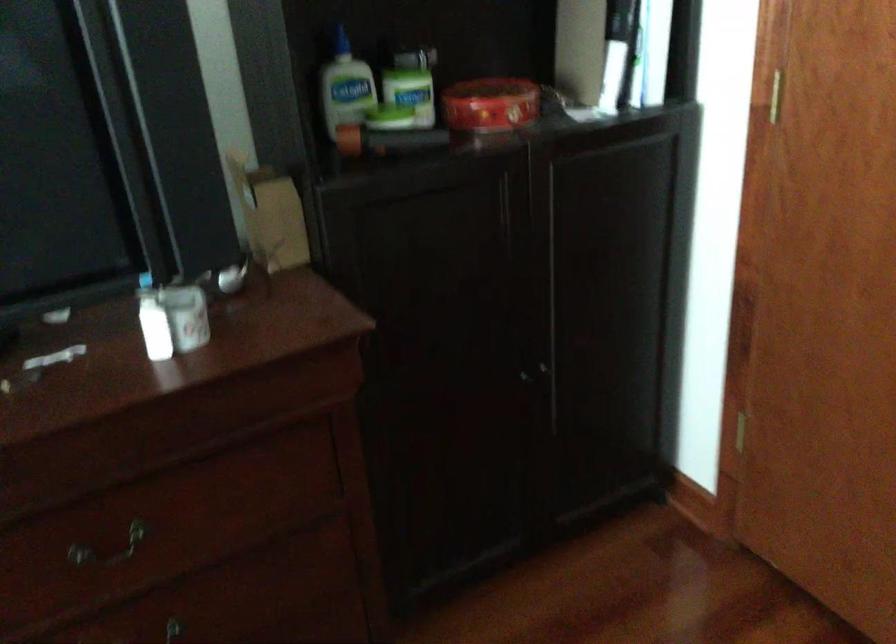
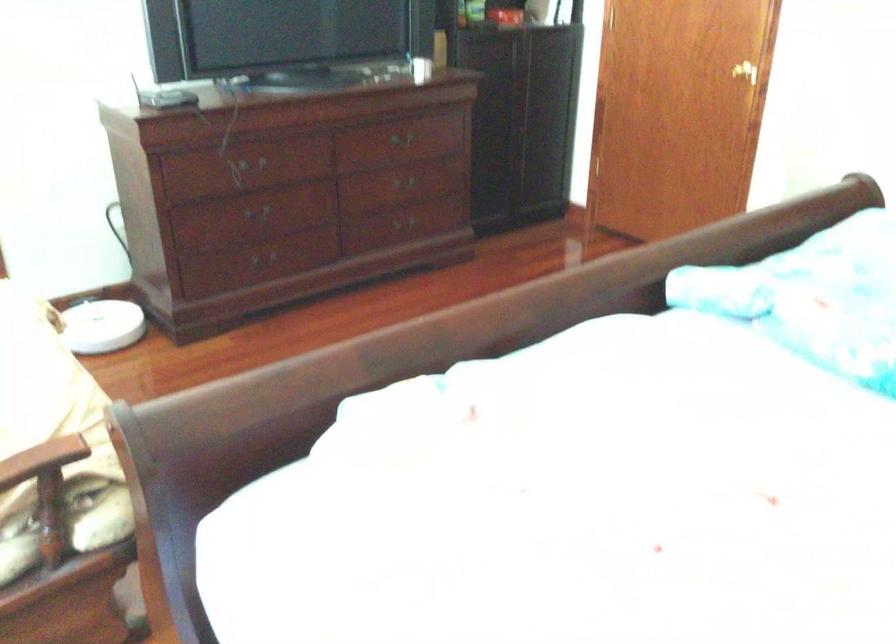
Question: What movement of the cameraman would produce the second image?

Choices:
 (A) Left
 (B) Right
 (C) Forward
 (D) Backward

Answer: (D)